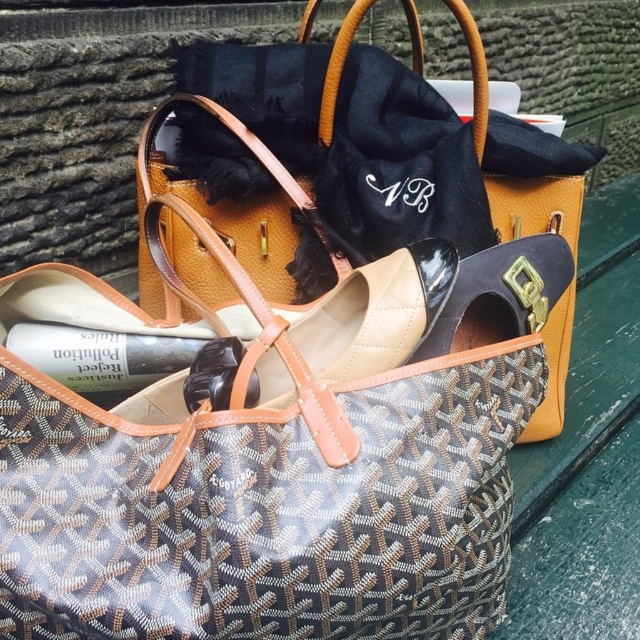
Question: Which point is closer to the camera?

Choices:
 (A) beige patent leather shoe at center
 (B) brown textured bag at center
 (C) brown textured tote at center

Answer: (C)

Question: Can you confirm if brown textured tote at center is positioned to the right of beige patent leather shoe at center?

Choices:
 (A) yes
 (B) no

Answer: (A)

Question: Can you confirm if brown textured tote at center is positioned to the right of beige patent leather shoe at center?

Choices:
 (A) no
 (B) yes

Answer: (B)

Question: Which point is farther from the camera taking this photo?

Choices:
 (A) (218, 310)
 (B) (58, 428)
 (C) (214, 262)

Answer: (C)

Question: Is brown textured tote at center below brown textured bag at center?

Choices:
 (A) no
 (B) yes

Answer: (B)

Question: Estimate the real-world distances between objects in this image. Which object is closer to the brown textured bag at center?

Choices:
 (A) beige patent leather shoe at center
 (B) brown textured tote at center

Answer: (A)